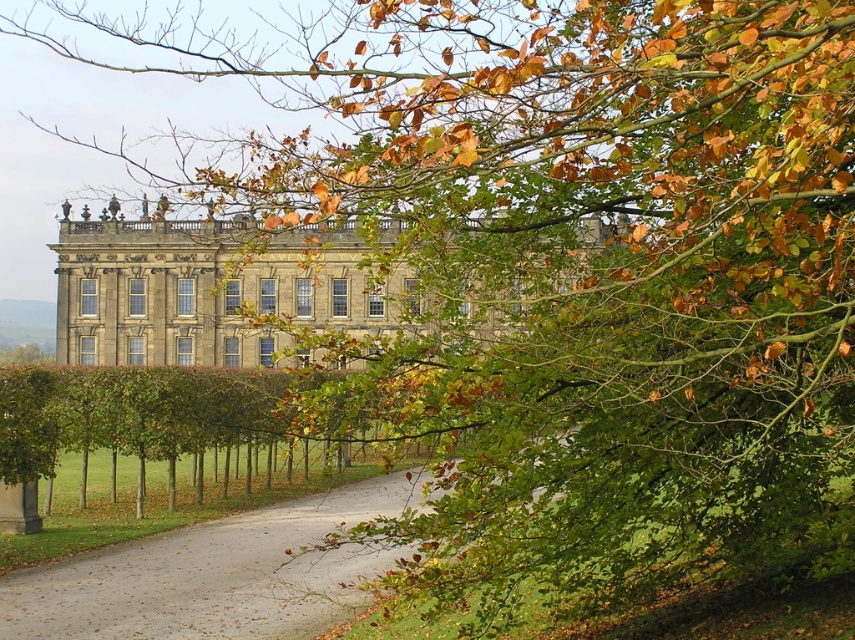
Is gray gravel driveway at center positioned behind green leafy hedge at center?

No, it is in front of green leafy hedge at center.

Image resolution: width=855 pixels, height=640 pixels. What do you see at coordinates (215, 573) in the screenshot?
I see `gray gravel driveway at center` at bounding box center [215, 573].

The image size is (855, 640). Find the location of `gray gravel driveway at center`. gray gravel driveway at center is located at coordinates click(215, 573).

Between gray stone palace at center and gray gravel driveway at center, which one is positioned lower?

gray gravel driveway at center is below.

The image size is (855, 640). Describe the element at coordinates (204, 289) in the screenshot. I see `gray stone palace at center` at that location.

In order to click on gray stone palace at center in this screenshot , I will do `click(204, 289)`.

Which of these two, gray stone palace at center or green leafy hedge at center, stands shorter?

Standing shorter between the two is green leafy hedge at center.

Does gray stone palace at center have a lesser width compared to green leafy hedge at center?

Incorrect, gray stone palace at center's width is not less than green leafy hedge at center's.

What do you see at coordinates (204, 289) in the screenshot?
I see `gray stone palace at center` at bounding box center [204, 289].

Where is `gray stone palace at center`? gray stone palace at center is located at coordinates (204, 289).